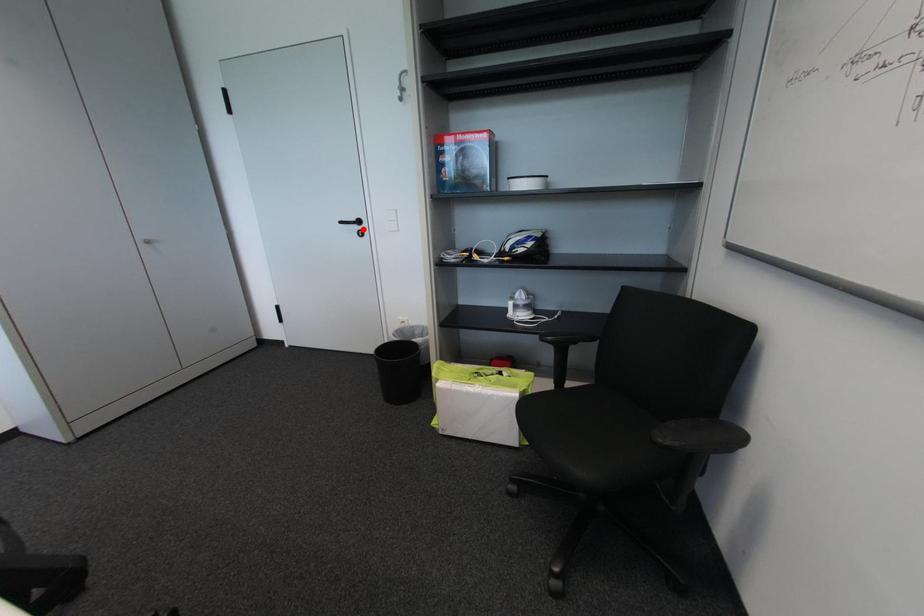
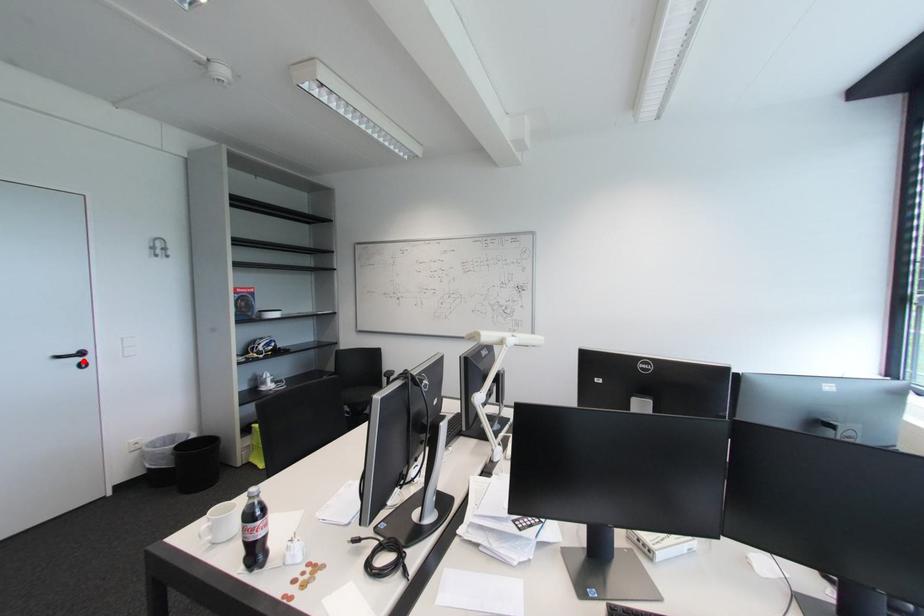
I am providing you with two images of the same scene from different viewpoints. A red point is marked on the first image and another point is marked on the second image. Are the points marked in image1 and image2 representing the same 3D position?

Yes